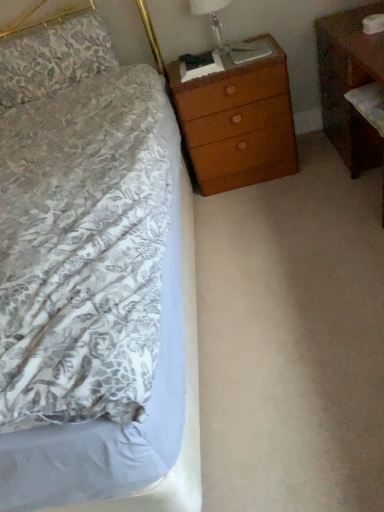
Question: Is brown wood nightstand at right placed right next to wooden chest of drawers at upper right?

Choices:
 (A) yes
 (B) no

Answer: (B)

Question: Is brown wood nightstand at right positioned beyond the bounds of wooden chest of drawers at upper right?

Choices:
 (A) no
 (B) yes

Answer: (B)

Question: Is wooden chest of drawers at upper right at the back of brown wood nightstand at right?

Choices:
 (A) yes
 (B) no

Answer: (B)

Question: Does brown wood nightstand at right have a smaller size compared to wooden chest of drawers at upper right?

Choices:
 (A) yes
 (B) no

Answer: (B)

Question: Is the depth of brown wood nightstand at right greater than that of wooden chest of drawers at upper right?

Choices:
 (A) no
 (B) yes

Answer: (A)

Question: Which is correct: wooden chest of drawers at upper right is inside floral fabric pillow at upper left, or outside of it?

Choices:
 (A) inside
 (B) outside

Answer: (B)

Question: Considering their positions, is wooden chest of drawers at upper right located in front of or behind floral fabric pillow at upper left?

Choices:
 (A) behind
 (B) front

Answer: (B)

Question: Considering the positions of wooden chest of drawers at upper right and floral fabric pillow at upper left in the image, is wooden chest of drawers at upper right wider or thinner than floral fabric pillow at upper left?

Choices:
 (A) thin
 (B) wide

Answer: (B)

Question: From a real-world perspective, is wooden chest of drawers at upper right physically located above or below floral fabric pillow at upper left?

Choices:
 (A) below
 (B) above

Answer: (A)

Question: Choose the correct answer: Is floral fabric pillow at upper left inside wooden chest of drawers at upper right or outside it?

Choices:
 (A) inside
 (B) outside

Answer: (B)

Question: Is floral fabric pillow at upper left to the left or to the right of wooden chest of drawers at upper right in the image?

Choices:
 (A) left
 (B) right

Answer: (A)

Question: Is point (92, 19) closer or farther from the camera than point (190, 98)?

Choices:
 (A) closer
 (B) farther

Answer: (B)

Question: In terms of width, does floral fabric pillow at upper left look wider or thinner when compared to wooden chest of drawers at upper right?

Choices:
 (A) wide
 (B) thin

Answer: (B)

Question: Is brown wood nightstand at right in front of or behind translucent glass lampshade at upper right in the image?

Choices:
 (A) front
 (B) behind

Answer: (A)

Question: From a real-world perspective, is brown wood nightstand at right positioned above or below translucent glass lampshade at upper right?

Choices:
 (A) below
 (B) above

Answer: (A)